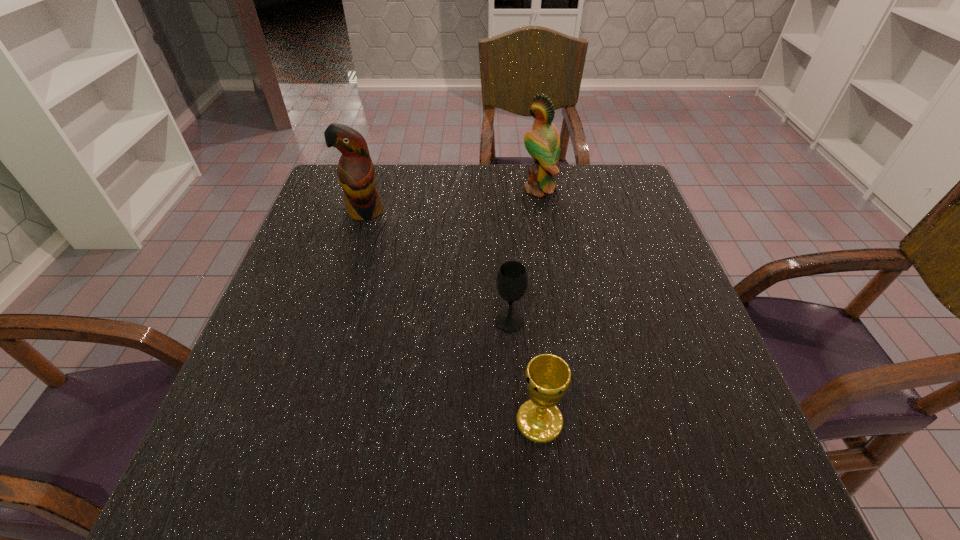
Where is `vacant region that satisfies the following two spatial constraints: 1. on the front-facing side of the right parrot; 2. on the face of the left parrot`? The width and height of the screenshot is (960, 540). vacant region that satisfies the following two spatial constraints: 1. on the front-facing side of the right parrot; 2. on the face of the left parrot is located at coordinates (542, 212).

Locate an element on the screen. vacant point that satisfies the following two spatial constraints: 1. on the face of the leftmost object; 2. on the left side of the chalice is located at coordinates (300, 421).

Locate an element on the screen. The width and height of the screenshot is (960, 540). vacant space that satisfies the following two spatial constraints: 1. on the face of the left parrot; 2. on the right side of the second nearest object is located at coordinates (330, 322).

At what (x,y) coordinates should I click in order to perform the action: click on blank area in the image that satisfies the following two spatial constraints: 1. on the front side of the wineglass; 2. on the right side of the chalice. Please return your answer as a coordinate pair (x, y). Looking at the image, I should click on (516, 421).

Identify the location of free space in the image that satisfies the following two spatial constraints: 1. on the front-facing side of the right parrot; 2. on the face of the leftmost object. (542, 212).

At what (x,y) coordinates should I click in order to perform the action: click on vacant area in the image that satisfies the following two spatial constraints: 1. on the face of the nearest object; 2. on the right side of the leftmost object. Please return your answer as a coordinate pair (x, y). The image size is (960, 540). Looking at the image, I should click on (300, 421).